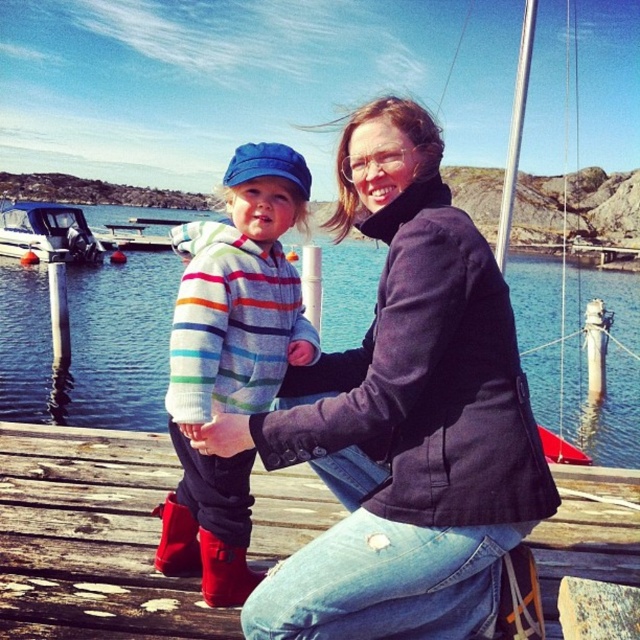
Question: Does striped sweater at center lie in front of white plastic boat at left?

Choices:
 (A) no
 (B) yes

Answer: (B)

Question: Which point appears closest to the camera in this image?

Choices:
 (A) (182, 572)
 (B) (211, 385)
 (C) (13, 248)

Answer: (A)

Question: Among these objects, which one is farthest from the camera?

Choices:
 (A) red suede boot at lower left
 (B) striped fleece sweater at center

Answer: (A)

Question: Can you confirm if blue water at dock center is positioned to the right of red suede boot at lower left?

Choices:
 (A) no
 (B) yes

Answer: (B)

Question: Can you confirm if striped fleece sweater at center is positioned below white plastic boat at left?

Choices:
 (A) yes
 (B) no

Answer: (A)

Question: Which of the following is the farthest from the observer?

Choices:
 (A) striped sweater at center
 (B) white plastic boat at left
 (C) red suede boot at lower left

Answer: (B)